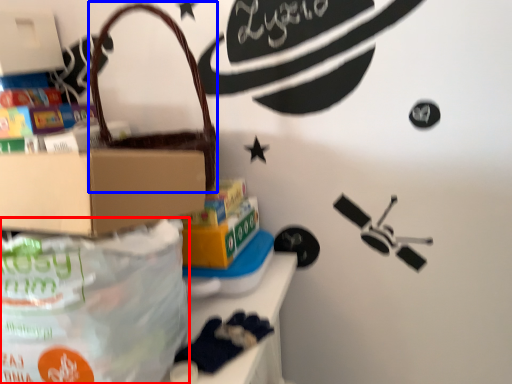
Question: Which object appears farthest to the camera in this image, diaper bag (highlighted by a red box) or handbag (highlighted by a blue box)?

Choices:
 (A) diaper bag
 (B) handbag

Answer: (B)